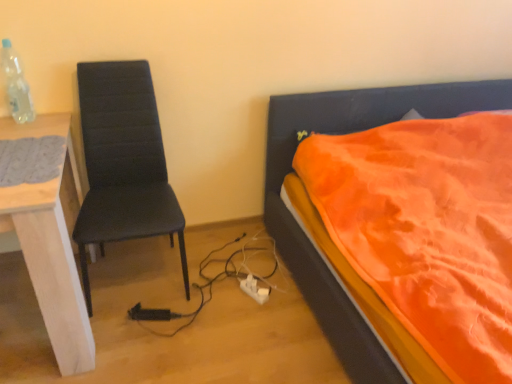
Question: Could you tell me if matte black chair at left is turned towards gray knitted mat at left?

Choices:
 (A) yes
 (B) no

Answer: (B)

Question: Can you confirm if matte black chair at left is shorter than gray knitted mat at left?

Choices:
 (A) no
 (B) yes

Answer: (A)

Question: Is matte black chair at left behind gray knitted mat at left?

Choices:
 (A) yes
 (B) no

Answer: (A)

Question: Does matte black chair at left have a greater height compared to gray knitted mat at left?

Choices:
 (A) no
 (B) yes

Answer: (B)

Question: Considering the relative sizes of matte black chair at left and gray knitted mat at left in the image provided, is matte black chair at left bigger than gray knitted mat at left?

Choices:
 (A) no
 (B) yes

Answer: (B)

Question: From the image's perspective, relative to white wood desk at left, is matte black chair at left above or below?

Choices:
 (A) below
 (B) above

Answer: (B)

Question: In terms of size, does matte black chair at left appear bigger or smaller than white wood desk at left?

Choices:
 (A) small
 (B) big

Answer: (A)

Question: Which is correct: matte black chair at left is inside white wood desk at left, or outside of it?

Choices:
 (A) outside
 (B) inside

Answer: (A)

Question: Considering the relative positions of matte black chair at left and white wood desk at left in the image provided, is matte black chair at left to the left or to the right of white wood desk at left?

Choices:
 (A) left
 (B) right

Answer: (B)

Question: Relative to gray knitted mat at left, is orange fabric bed at right in front or behind?

Choices:
 (A) front
 (B) behind

Answer: (A)

Question: Considering the positions of orange fabric bed at right and gray knitted mat at left in the image, is orange fabric bed at right taller or shorter than gray knitted mat at left?

Choices:
 (A) tall
 (B) short

Answer: (A)

Question: Considering the positions of orange fabric bed at right and gray knitted mat at left in the image, is orange fabric bed at right bigger or smaller than gray knitted mat at left?

Choices:
 (A) big
 (B) small

Answer: (A)

Question: Is orange fabric bed at right spatially inside gray knitted mat at left, or outside of it?

Choices:
 (A) inside
 (B) outside

Answer: (B)

Question: From a real-world perspective, is orange fabric bed at right above or below white plastic power plugs and sockets at lower center?

Choices:
 (A) above
 (B) below

Answer: (A)

Question: Considering their positions, is orange fabric bed at right located in front of or behind white plastic power plugs and sockets at lower center?

Choices:
 (A) front
 (B) behind

Answer: (A)